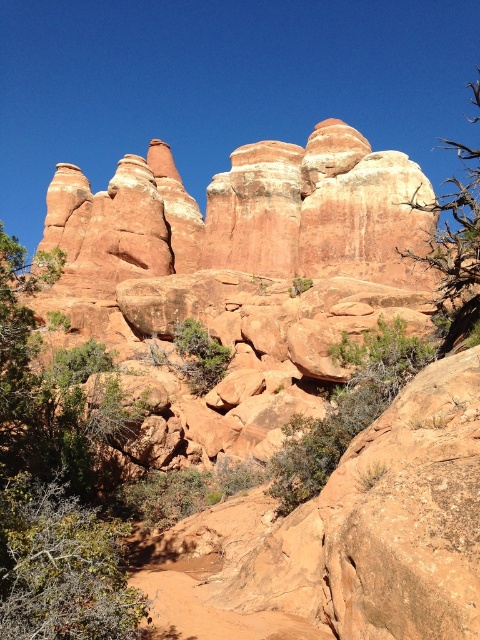
Consider the image. You are a hiker standing at the base of the red rock formations and you see the green leafy shrub at left and the green leafy bush at lower left. Which one is higher up from the ground?

Result: The green leafy shrub at left is higher up from the ground than the green leafy bush at lower left.

You are a hiker who wants to take a photo of the rustic sandstone rock formation at center and the green leafy bush at lower left. Which object should you focus on first if you want to capture both in a single frame without moving your camera?

You should focus on the rustic sandstone rock formation at center first because it is positioned over the green leafy bush at lower left, meaning it is closer to the camera. By focusing on the closer object, both will be in focus due to the depth of field.

You are a hiker standing at the base of the rustic sandstone rock formation at center and the green leafy shrub at left. Which object is taller?

The rustic sandstone rock formation at center is taller than the green leafy shrub at left.